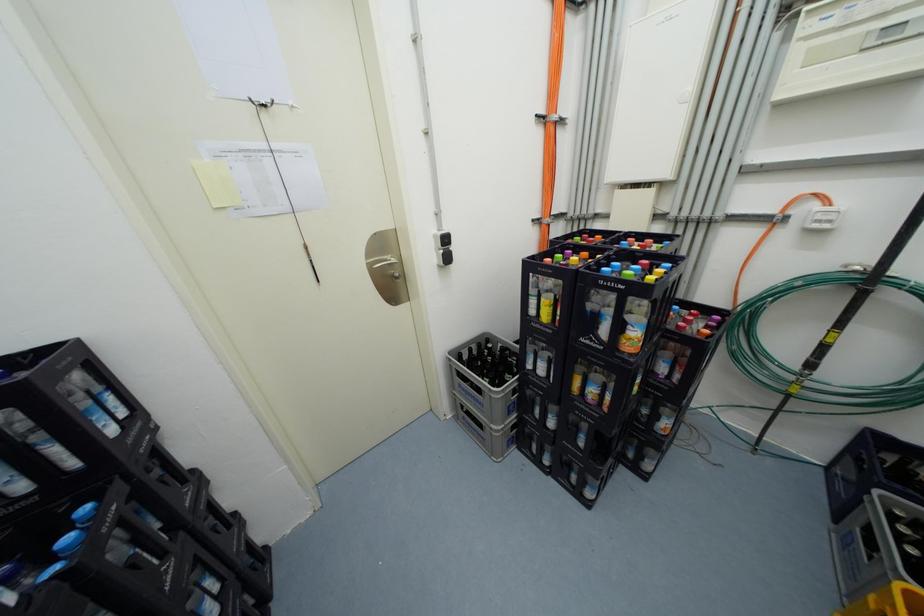
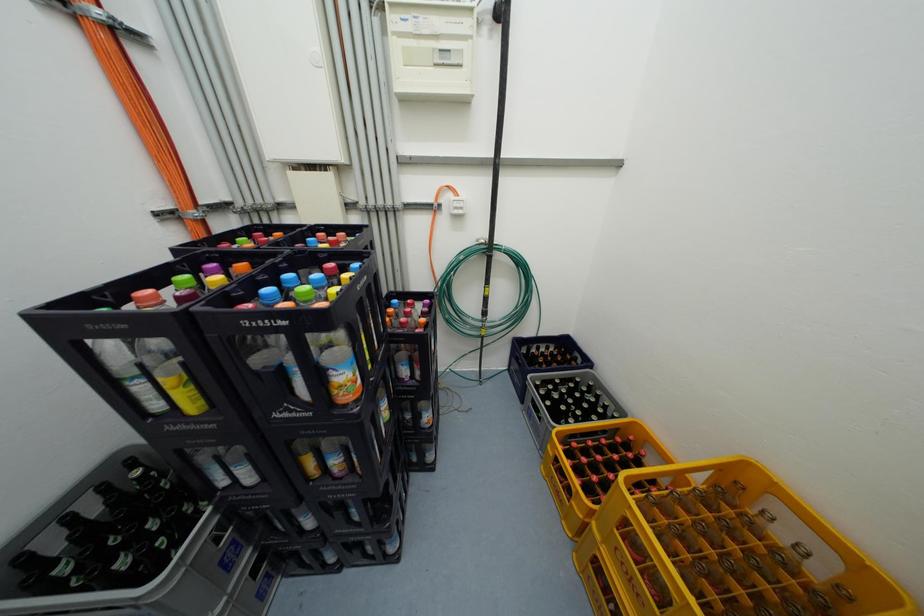
Question: Based on the continuous images, in which direction is the camera rotating? Reply with the corresponding letter.

Choices:
 (A) Left
 (B) Right
 (C) Up
 (D) Down

Answer: (B)